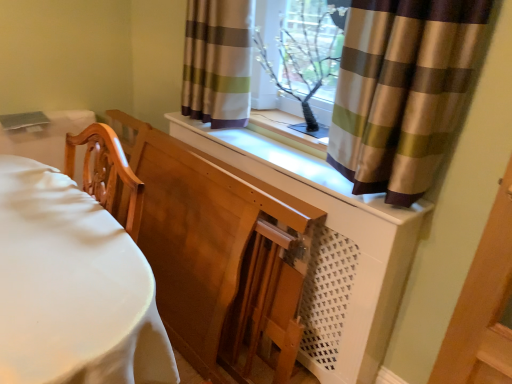
This screenshot has width=512, height=384. Identify the location of free region under striped fabric curtain at upper center, arranged as the 2th curtain when viewed from the front (from a real-world perspective). (219, 132).